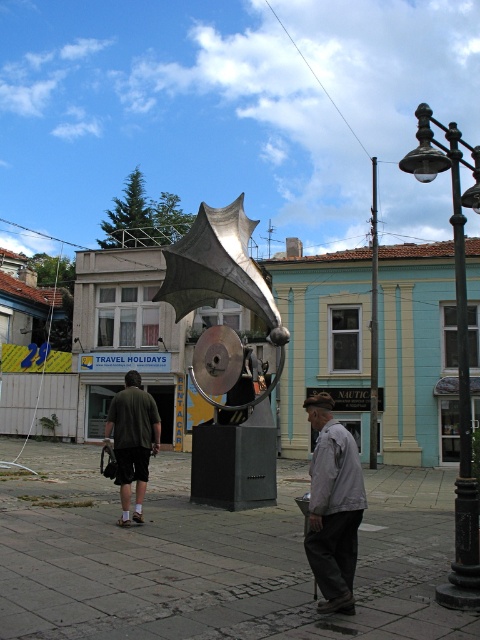
You are an urban planner assessing the space between the shiny metallic sculpture at center and the metallic pole at center. Which object has a smaller width?

The shiny metallic sculpture at center is thinner than the metallic pole at center, so the shiny metallic sculpture at center has a smaller width.

You are a tourist standing in front of the shiny metallic sculpture at center and the black metal streetlight at right. You want to take a photo of the streetlight. Should you move forward or backward to get the streetlight in focus without the sculpture blocking it?

The black metal streetlight at right is behind the shiny metallic sculpture at center, so to avoid the sculpture blocking the streetlight, you should move backward to get the streetlight in focus.